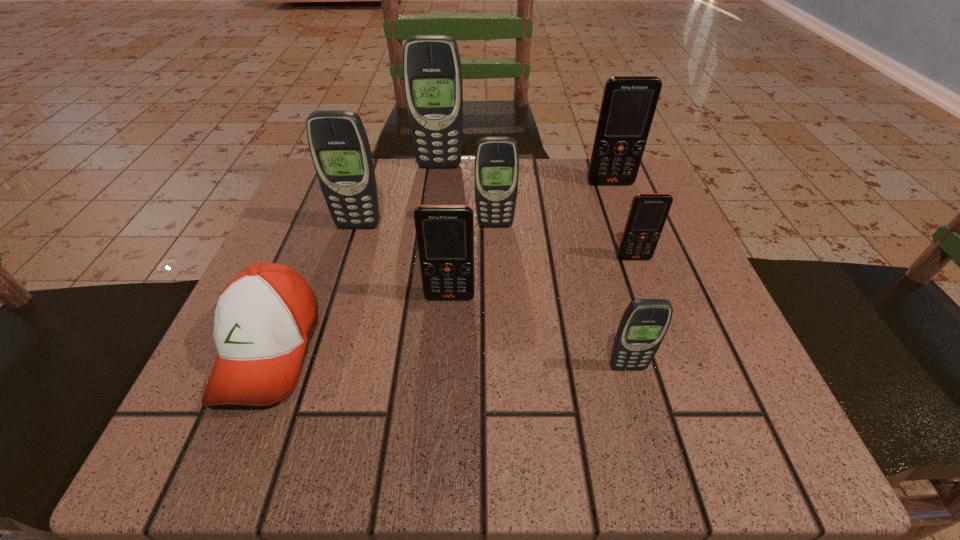
What are the coordinates of `the second farthest orange cellular telephone` in the screenshot? It's located at (648, 212).

Identify the location of the nearest gray cellular telephone. (643, 326).

Find the location of a particular element. The width and height of the screenshot is (960, 540). the smallest gray cellular telephone is located at coordinates click(x=643, y=326).

The height and width of the screenshot is (540, 960). I want to click on orange baseball cap, so click(x=263, y=317).

This screenshot has height=540, width=960. I want to click on baseball cap, so click(x=263, y=317).

Locate an element on the screen. vacant space located 0.150m on the screen of the biggest gray cellular telephone is located at coordinates (434, 210).

Find the location of a particular element. The width and height of the screenshot is (960, 540). blank space located on the screen of the farthest orange cellular telephone is located at coordinates (655, 303).

At what (x,y) coordinates should I click in order to perform the action: click on vacant space located on the screen of the third smallest gray cellular telephone. Please return your answer as a coordinate pair (x, y). Looking at the image, I should click on (332, 310).

Find the location of `vacant space located on the screen of the second gray cellular telephone from right to left`. vacant space located on the screen of the second gray cellular telephone from right to left is located at coordinates (496, 268).

Where is `free location located 0.190m on the screen of the nearest orange cellular telephone`? free location located 0.190m on the screen of the nearest orange cellular telephone is located at coordinates (443, 411).